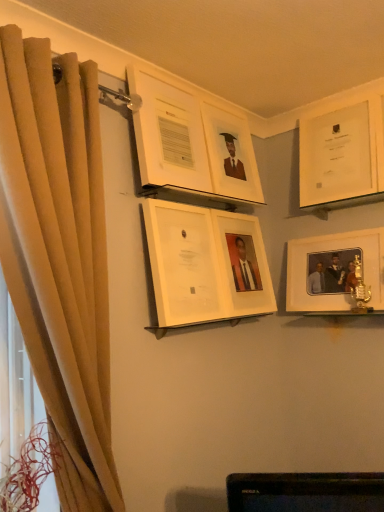
Locate an element on the screen. beige fabric curtain at left is located at coordinates (59, 255).

Where is `white glossy picture frame at upper center, positioned as the sixth picture frame in right-to-left order`? white glossy picture frame at upper center, positioned as the sixth picture frame in right-to-left order is located at coordinates (191, 141).

This screenshot has width=384, height=512. What do you see at coordinates (243, 263) in the screenshot? I see `white matte picture frame at center, positioned as the fourth picture frame in left-to-right order` at bounding box center [243, 263].

This screenshot has width=384, height=512. What are the coordinates of `white matte picture frame at center, the third picture frame in the right-to-left sequence` in the screenshot? It's located at (243, 263).

I want to click on white glossy picture frame at center, the second picture frame positioned from the left, so click(x=205, y=264).

Locate an element on the screen. The image size is (384, 512). matte white picture frame at upper center, acting as the third picture frame starting from the left is located at coordinates (231, 154).

How many degrees apart are the facing directions of white glossy picture frame at upper center, positioned as the sixth picture frame in right-to-left order, and white glossy picture frame at upper right, the 6th picture frame viewed from the left?

There is a 89.8-degree angle between the facing directions of white glossy picture frame at upper center, positioned as the sixth picture frame in right-to-left order, and white glossy picture frame at upper right, the 6th picture frame viewed from the left.

Does white glossy picture frame at upper center, the 1th picture frame when ordered from left to right, have a greater height compared to white glossy picture frame at upper right, acting as the first picture frame starting from the right?

In fact, white glossy picture frame at upper center, the 1th picture frame when ordered from left to right, may be shorter than white glossy picture frame at upper right, acting as the first picture frame starting from the right.

Is white glossy picture frame at upper center, positioned as the sixth picture frame in right-to-left order, oriented towards white glossy picture frame at upper right, the 6th picture frame viewed from the left?

No, white glossy picture frame at upper center, positioned as the sixth picture frame in right-to-left order, is not aimed at white glossy picture frame at upper right, the 6th picture frame viewed from the left.

Is white glossy picture frame at upper center, positioned as the sixth picture frame in right-to-left order, next to white glossy picture frame at upper right, acting as the first picture frame starting from the right?

No, white glossy picture frame at upper center, positioned as the sixth picture frame in right-to-left order, is not making contact with white glossy picture frame at upper right, acting as the first picture frame starting from the right.

You are a GUI agent. You are given a task and a screenshot of the screen. Output one action in this format:
    pyautogui.click(x=<x>, y=<y>)
    Task: Click on the picture frame that is the 4th object located below the white glossy picture frame at upper center, positioned as the sixth picture frame in right-to-left order (from the image's perspective)
    The image size is (384, 512).
    Given the screenshot: What is the action you would take?
    (x=336, y=273)

Which object is positioned more to the left, white matte picture frame at right, marked as the 2th picture frame in a right-to-left arrangement, or white glossy picture frame at upper center, the 1th picture frame when ordered from left to right?

white glossy picture frame at upper center, the 1th picture frame when ordered from left to right.

Consider the image. Does white matte picture frame at right, positioned as the fifth picture frame in left-to-right order, come behind white glossy picture frame at upper center, positioned as the sixth picture frame in right-to-left order?

Yes, the depth of white matte picture frame at right, positioned as the fifth picture frame in left-to-right order, is greater than that of white glossy picture frame at upper center, positioned as the sixth picture frame in right-to-left order.

Can you tell me how much white matte picture frame at right, marked as the 2th picture frame in a right-to-left arrangement, and white glossy picture frame at upper center, the 1th picture frame when ordered from left to right, differ in facing direction?

The angle between the facing direction of white matte picture frame at right, marked as the 2th picture frame in a right-to-left arrangement, and the facing direction of white glossy picture frame at upper center, the 1th picture frame when ordered from left to right, is 89.9 degrees.

Is white glossy picture frame at upper center, positioned as the sixth picture frame in right-to-left order, at the back of white matte picture frame at center, positioned as the fourth picture frame in left-to-right order?

No, white glossy picture frame at upper center, positioned as the sixth picture frame in right-to-left order, is not at the back of white matte picture frame at center, positioned as the fourth picture frame in left-to-right order.

Is point (261, 262) positioned after point (255, 185)?

Yes.

How many degrees apart are the facing directions of white matte picture frame at center, positioned as the fourth picture frame in left-to-right order, and white glossy picture frame at upper center, the 1th picture frame when ordered from left to right?

0.281 degrees separate the facing orientations of white matte picture frame at center, positioned as the fourth picture frame in left-to-right order, and white glossy picture frame at upper center, the 1th picture frame when ordered from left to right.

From the white matte picture frame at center, the third picture frame in the right-to-left sequence, count 1st picture frames forward and point to it. Please provide its 2D coordinates.

[(191, 141)]

What are the coordinates of `the 1st picture frame behind the beige fabric curtain at left` in the screenshot? It's located at (205, 264).

Is white glossy picture frame at center, the second picture frame positioned from the left, in front of or behind beige fabric curtain at left in the image?

Visually, white glossy picture frame at center, the second picture frame positioned from the left, is located behind beige fabric curtain at left.

Looking at their sizes, would you say white glossy picture frame at center, the second picture frame positioned from the left, is wider or thinner than beige fabric curtain at left?

white glossy picture frame at center, the second picture frame positioned from the left, is thinner than beige fabric curtain at left.

How much distance is there between white glossy picture frame at center, which is the fifth picture frame in right-to-left order, and beige fabric curtain at left?

The distance of white glossy picture frame at center, which is the fifth picture frame in right-to-left order, from beige fabric curtain at left is 19.23 inches.

From a real-world perspective, is beige fabric curtain at left over matte white picture frame at upper center, which ranks as the 4th picture frame in right-to-left order?

No.

Can you confirm if beige fabric curtain at left is thinner than matte white picture frame at upper center, which ranks as the 4th picture frame in right-to-left order?

No.

Is matte white picture frame at upper center, acting as the third picture frame starting from the left, at the back of beige fabric curtain at left?

No, beige fabric curtain at left's orientation is not away from matte white picture frame at upper center, acting as the third picture frame starting from the left.

What's the angular difference between beige fabric curtain at left and matte white picture frame at upper center, which ranks as the 4th picture frame in right-to-left order,'s facing directions?

1.5 degrees separate the facing orientations of beige fabric curtain at left and matte white picture frame at upper center, which ranks as the 4th picture frame in right-to-left order.

Is beige fabric curtain at left surrounded by white matte picture frame at right, marked as the 2th picture frame in a right-to-left arrangement?

No, white matte picture frame at right, marked as the 2th picture frame in a right-to-left arrangement, does not contain beige fabric curtain at left.

Is white matte picture frame at right, marked as the 2th picture frame in a right-to-left arrangement, not near beige fabric curtain at left?

Indeed, white matte picture frame at right, marked as the 2th picture frame in a right-to-left arrangement, is not near beige fabric curtain at left.

Measure the distance between white matte picture frame at right, positioned as the fifth picture frame in left-to-right order, and beige fabric curtain at left.

white matte picture frame at right, positioned as the fifth picture frame in left-to-right order, and beige fabric curtain at left are 3.70 feet apart.

Which object is further away from the camera taking this photo, white matte picture frame at right, marked as the 2th picture frame in a right-to-left arrangement, or beige fabric curtain at left?

white matte picture frame at right, marked as the 2th picture frame in a right-to-left arrangement, is further from the camera.

Considering their positions, is matte white picture frame at upper center, which ranks as the 4th picture frame in right-to-left order, located in front of or behind beige fabric curtain at left?

Visually, matte white picture frame at upper center, which ranks as the 4th picture frame in right-to-left order, is located behind beige fabric curtain at left.

Considering the points (252, 170) and (49, 188), which point is in front, point (252, 170) or point (49, 188)?

The point (49, 188) is in front.

Is matte white picture frame at upper center, acting as the third picture frame starting from the left, placed right next to beige fabric curtain at left?

matte white picture frame at upper center, acting as the third picture frame starting from the left, and beige fabric curtain at left are clearly separated.

From the image's perspective, does matte white picture frame at upper center, acting as the third picture frame starting from the left, appear lower than beige fabric curtain at left?

Actually, matte white picture frame at upper center, acting as the third picture frame starting from the left, appears above beige fabric curtain at left in the image.

Locate an element on the screen. picture frame that is the 5th object to the right of the white glossy picture frame at upper center, positioned as the sixth picture frame in right-to-left order, starting at the anchor is located at coordinates [342, 149].

Locate an element on the screen. the 4th picture frame positioned below the white glossy picture frame at upper center, the 1th picture frame when ordered from left to right (from the image's perspective) is located at coordinates (336, 273).

Which object lies nearer to the anchor point white glossy picture frame at center, the second picture frame positioned from the left, white glossy picture frame at upper center, the 1th picture frame when ordered from left to right, or white matte picture frame at right, marked as the 2th picture frame in a right-to-left arrangement?

white glossy picture frame at upper center, the 1th picture frame when ordered from left to right, is positioned closer to the anchor white glossy picture frame at center, the second picture frame positioned from the left.

Which object lies further to the anchor point white matte picture frame at center, positioned as the fourth picture frame in left-to-right order, beige fabric curtain at left or white glossy picture frame at upper center, the 1th picture frame when ordered from left to right?

beige fabric curtain at left is positioned further to the anchor white matte picture frame at center, positioned as the fourth picture frame in left-to-right order.

Based on their spatial positions, is beige fabric curtain at left or white glossy picture frame at upper center, the 1th picture frame when ordered from left to right, closer to white glossy picture frame at upper right, the 6th picture frame viewed from the left?

white glossy picture frame at upper center, the 1th picture frame when ordered from left to right, is positioned closer to the anchor white glossy picture frame at upper right, the 6th picture frame viewed from the left.

Considering their positions, is beige fabric curtain at left positioned further to matte white picture frame at upper center, which ranks as the 4th picture frame in right-to-left order, than white glossy picture frame at upper center, positioned as the sixth picture frame in right-to-left order?

The object further to matte white picture frame at upper center, which ranks as the 4th picture frame in right-to-left order, is beige fabric curtain at left.

Looking at the image, which one is located further to white matte picture frame at center, the third picture frame in the right-to-left sequence, beige fabric curtain at left or matte white picture frame at upper center, which ranks as the 4th picture frame in right-to-left order?

Based on the image, beige fabric curtain at left appears to be further to white matte picture frame at center, the third picture frame in the right-to-left sequence.

When comparing their distances from white glossy picture frame at center, the second picture frame positioned from the left, does matte white picture frame at upper center, acting as the third picture frame starting from the left, or white glossy picture frame at upper center, the 1th picture frame when ordered from left to right, seem further?

The object further to white glossy picture frame at center, the second picture frame positioned from the left, is matte white picture frame at upper center, acting as the third picture frame starting from the left.

Looking at the image, which one is located further to white glossy picture frame at center, the second picture frame positioned from the left, white glossy picture frame at upper right, the 6th picture frame viewed from the left, or white glossy picture frame at upper center, the 1th picture frame when ordered from left to right?

The object further to white glossy picture frame at center, the second picture frame positioned from the left, is white glossy picture frame at upper right, the 6th picture frame viewed from the left.

From the picture: Based on their spatial positions, is white matte picture frame at center, the third picture frame in the right-to-left sequence, or white glossy picture frame at upper center, positioned as the sixth picture frame in right-to-left order, further from white matte picture frame at right, positioned as the fifth picture frame in left-to-right order?

white glossy picture frame at upper center, positioned as the sixth picture frame in right-to-left order, is positioned further to the anchor white matte picture frame at right, positioned as the fifth picture frame in left-to-right order.

In order to click on picture frame that lies between white glossy picture frame at upper center, the 1th picture frame when ordered from left to right, and white glossy picture frame at center, the second picture frame positioned from the left, from top to bottom in this screenshot , I will do `click(231, 154)`.

This screenshot has height=512, width=384. Identify the location of picture frame between matte white picture frame at upper center, acting as the third picture frame starting from the left, and white matte picture frame at center, the third picture frame in the right-to-left sequence, from top to bottom. (205, 264).